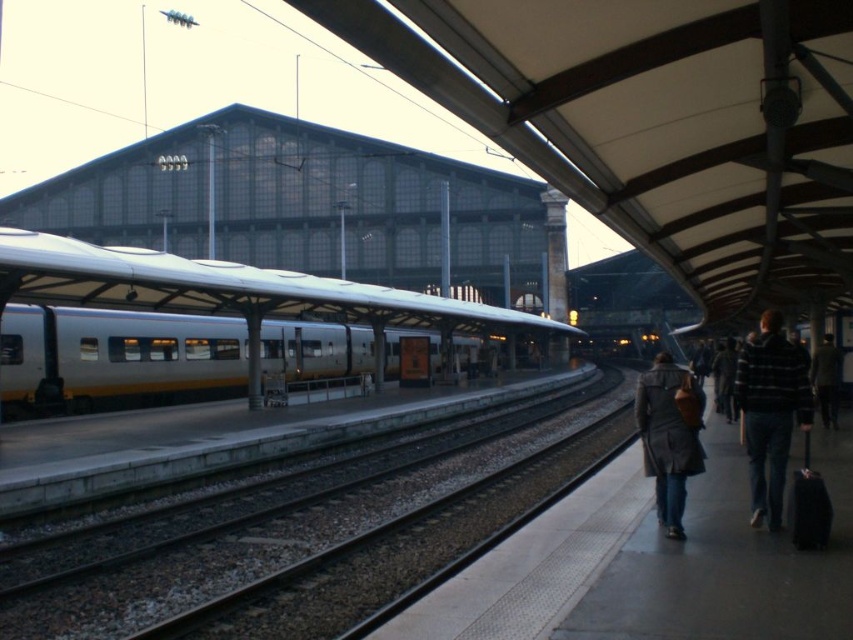
Consider the image. Is dark gray coat at lower right behind dark brown leather jacket at lower right?

No, it is in front of dark brown leather jacket at lower right.

Who is positioned more to the left, dark gray coat at lower right or dark brown leather jacket at lower right?

From the viewer's perspective, dark gray coat at lower right appears more on the left side.

Which is behind, point (688, 454) or point (825, 400)?

Positioned behind is point (825, 400).

Where is `dark gray coat at lower right`? dark gray coat at lower right is located at coordinates (669, 435).

Can you confirm if silver metallic train at center is taller than dark gray coat at lower right?

Yes, silver metallic train at center is taller than dark gray coat at lower right.

Where is `silver metallic train at center`? The height and width of the screenshot is (640, 853). silver metallic train at center is located at coordinates (115, 358).

Is point (144, 365) positioned behind point (701, 392)?

Yes.

Image resolution: width=853 pixels, height=640 pixels. Identify the location of silver metallic train at center. pyautogui.click(x=115, y=358).

Which is in front, point (781, 392) or point (827, 378)?

Positioned in front is point (781, 392).

Is point (796, 388) closer to camera compared to point (834, 378)?

Yes.

Identify the location of striped sweater at right. (770, 412).